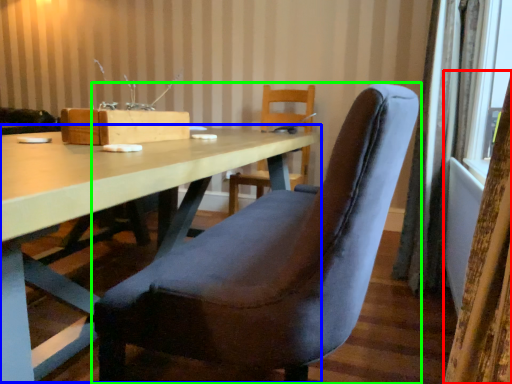
Question: Considering the real-world distances, which object is farthest from curtain (highlighted by a red box)? table (highlighted by a blue box) or chair (highlighted by a green box)?

Choices:
 (A) table
 (B) chair

Answer: (A)